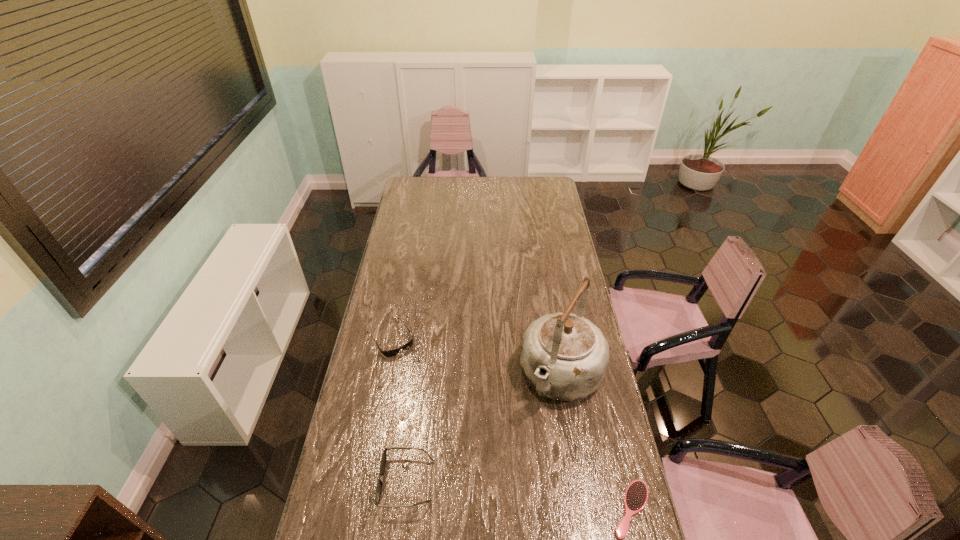
In order to click on the nearer sunglasses in this screenshot , I will do `click(383, 459)`.

Where is `hairbrush`? This screenshot has height=540, width=960. hairbrush is located at coordinates (636, 495).

Locate an element on the screen. The image size is (960, 540). the farther sunglasses is located at coordinates (389, 353).

You are a GUI agent. You are given a task and a screenshot of the screen. Output one action in this format:
    pyautogui.click(x=<x>, y=<y>)
    Task: Click on the kettle
    
    Given the screenshot: What is the action you would take?
    pyautogui.click(x=564, y=356)

At what (x,y) coordinates should I click in order to perform the action: click on free space located 0.130m on the front-facing side of the nearer sunglasses. Please return your answer as a coordinate pair (x, y). The height and width of the screenshot is (540, 960). Looking at the image, I should click on (339, 481).

You are a GUI agent. You are given a task and a screenshot of the screen. Output one action in this format:
    pyautogui.click(x=<x>, y=<y>)
    Task: Click on the vacant space located on the back of the shortest object
    
    Given the screenshot: What is the action you would take?
    pyautogui.click(x=613, y=433)

I want to click on vacant space located 0.380m on the front-facing side of the farther sunglasses, so tap(450, 428).

Where is `vacant space situated 0.070m on the front-facing side of the farther sunglasses`? The image size is (960, 540). vacant space situated 0.070m on the front-facing side of the farther sunglasses is located at coordinates (410, 367).

Locate an element on the screen. vacant region located on the front-facing side of the farther sunglasses is located at coordinates (435, 404).

The image size is (960, 540). Identify the location of free region located at the spout of the tallest object. (504, 483).